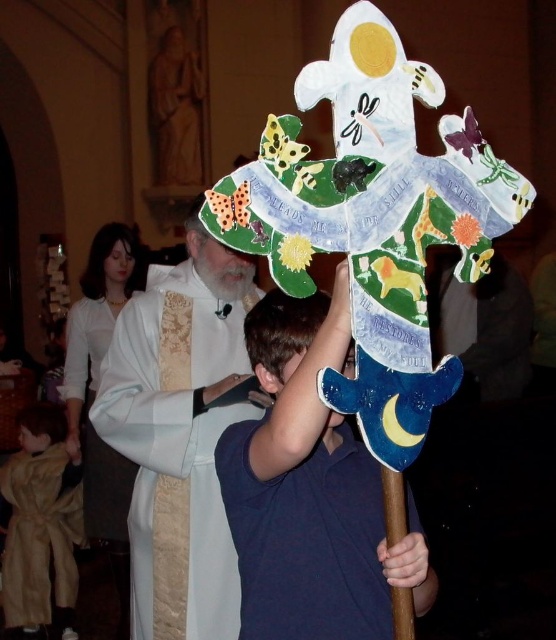
You are a visitor in the church and want to take a photo of the blue paper shield at center and the light brown plush robe at lower left. Which object should you focus on first if you want to capture both in one shot without moving the camera?

The blue paper shield at center has a lesser height compared to the light brown plush robe at lower left, so you should focus on the light brown plush robe at lower left first to ensure both are in frame.

You are an interior designer assessing the layout of a church. You notice the white clothed figure at center and the white silk robe at left. Which object is closer to the entrance of the church?

The white clothed figure at center is closer to the entrance of the church because it is positioned over the white silk robe at left, indicating it is in front spatially.